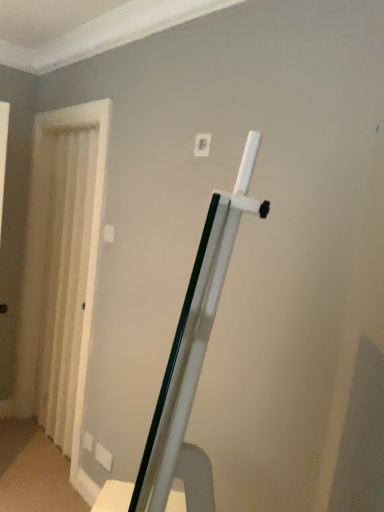
Measure the distance between white textured curtain at left and camera.

The distance of white textured curtain at left from camera is 2.36 meters.

The width and height of the screenshot is (384, 512). Describe the element at coordinates (65, 282) in the screenshot. I see `white textured curtain at left` at that location.

At what (x,y) coordinates should I click in order to perform the action: click on white textured curtain at left. Please return your answer as a coordinate pair (x, y). Looking at the image, I should click on (65, 282).

The height and width of the screenshot is (512, 384). What do you see at coordinates (202, 145) in the screenshot?
I see `white plastic light switch at upper center` at bounding box center [202, 145].

Locate an element on the screen. This screenshot has width=384, height=512. white plastic light switch at upper center is located at coordinates (202, 145).

Find the location of a particular element. This screenshot has width=384, height=512. white textured curtain at left is located at coordinates click(65, 282).

Is white textured curtain at left at the right side of white plastic light switch at upper center?

No, white textured curtain at left is not to the right of white plastic light switch at upper center.

Is white textured curtain at left closer to the viewer compared to white plastic light switch at upper center?

No, the depth of white textured curtain at left is greater than that of white plastic light switch at upper center.

Which point is more forward, (64, 259) or (203, 133)?

The point (203, 133) is closer to the camera.

From the image's perspective, is white textured curtain at left beneath white plastic light switch at upper center?

Indeed, from the image's perspective, white textured curtain at left is shown beneath white plastic light switch at upper center.

From a real-world perspective, is white textured curtain at left positioned above or below white plastic light switch at upper center?

white textured curtain at left is below white plastic light switch at upper center.

In terms of width, does white textured curtain at left look wider or thinner when compared to white plastic light switch at upper center?

white textured curtain at left is wider than white plastic light switch at upper center.

Considering the sizes of objects white textured curtain at left and white plastic light switch at upper center in the image provided, who is shorter, white textured curtain at left or white plastic light switch at upper center?

white plastic light switch at upper center is shorter.

Is white textured curtain at left bigger than white plastic light switch at upper center?

Yes, white textured curtain at left is bigger than white plastic light switch at upper center.

Would you say white textured curtain at left is outside white plastic light switch at upper center?

Yes, white textured curtain at left is located beyond the bounds of white plastic light switch at upper center.

Would you consider white textured curtain at left to be distant from white plastic light switch at upper center?

→ Yes, white textured curtain at left is far from white plastic light switch at upper center.

Is white textured curtain at left aimed at white plastic light switch at upper center?

No, white textured curtain at left is not oriented towards white plastic light switch at upper center.

How different are the orientations of white textured curtain at left and white plastic light switch at upper center in degrees?

10.3 degrees.

I want to click on curtain behind the white plastic light switch at upper center, so click(65, 282).

Considering the relative positions of white plastic light switch at upper center and white textured curtain at left in the image provided, is white plastic light switch at upper center to the right of white textured curtain at left from the viewer's perspective?

Yes.

Is white plastic light switch at upper center in front of or behind white textured curtain at left in the image?

Clearly, white plastic light switch at upper center is in front of white textured curtain at left.

Does point (208, 143) lie in front of point (59, 231)?

That is True.

From the image's perspective, is white plastic light switch at upper center above white textured curtain at left?

Yes, from the image's perspective, white plastic light switch at upper center is on top of white textured curtain at left.

From a real-world perspective, is white plastic light switch at upper center physically located above or below white textured curtain at left?

In terms of real-world spatial position, white plastic light switch at upper center is above white textured curtain at left.

Consider the image. Does white plastic light switch at upper center have a lesser width compared to white textured curtain at left?

Yes, white plastic light switch at upper center is thinner than white textured curtain at left.

Is white plastic light switch at upper center shorter than white textured curtain at left?

Correct, white plastic light switch at upper center is not as tall as white textured curtain at left.

Considering the relative sizes of white plastic light switch at upper center and white textured curtain at left in the image provided, is white plastic light switch at upper center smaller than white textured curtain at left?

Yes.

Looking at this image, is white plastic light switch at upper center situated inside white textured curtain at left or outside?

white plastic light switch at upper center cannot be found inside white textured curtain at left.

Is white plastic light switch at upper center with white textured curtain at left?

No, white plastic light switch at upper center is not with white textured curtain at left.

Is white plastic light switch at upper center aimed at white textured curtain at left?

No, white plastic light switch at upper center does not turn towards white textured curtain at left.

Where is `light switch on the right of the white textured curtain at left`? Image resolution: width=384 pixels, height=512 pixels. light switch on the right of the white textured curtain at left is located at coordinates (202, 145).

This screenshot has width=384, height=512. Find the location of `light switch that appears above the white textured curtain at left (from a real-world perspective)`. light switch that appears above the white textured curtain at left (from a real-world perspective) is located at coordinates (202, 145).

In the image, there is a white plastic light switch at upper center. Identify the location of curtain below it (from the image's perspective). 65,282.